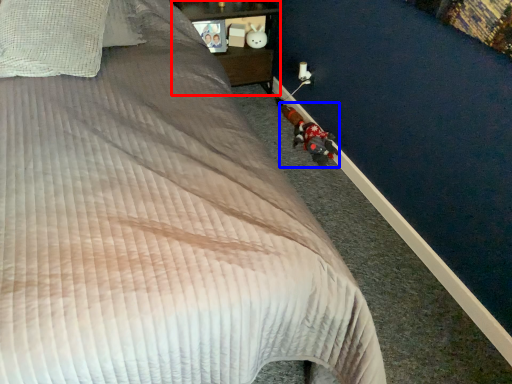
Question: Among these objects, which one is farthest to the camera, furniture (highlighted by a red box) or toy (highlighted by a blue box)?

Choices:
 (A) furniture
 (B) toy

Answer: (A)